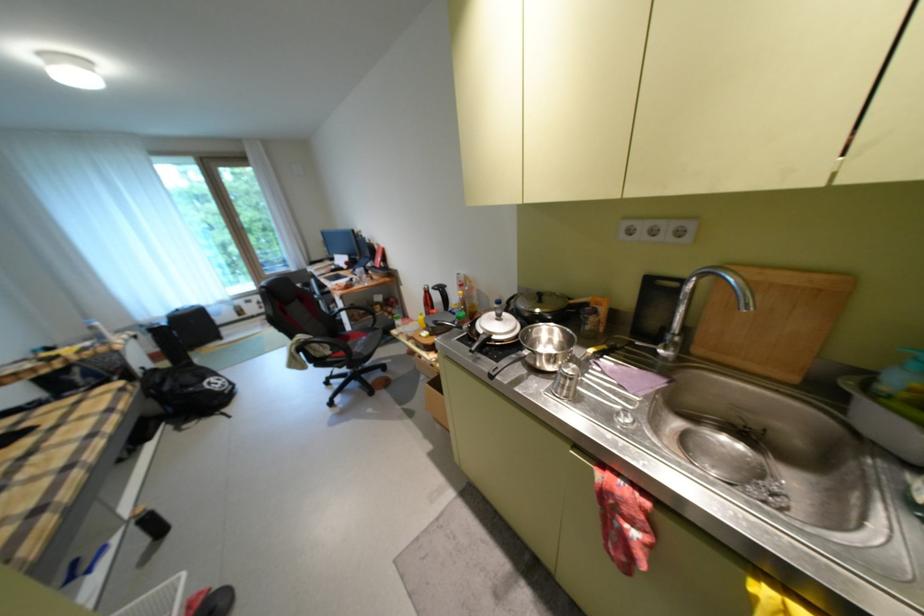
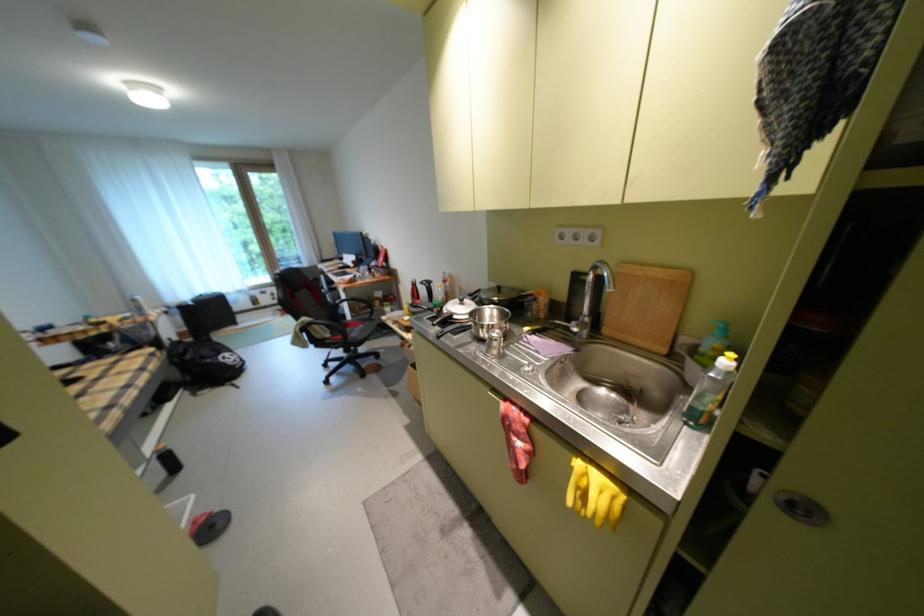
In the second image, find the point that corresponds to (578,369) in the first image.

(504, 333)